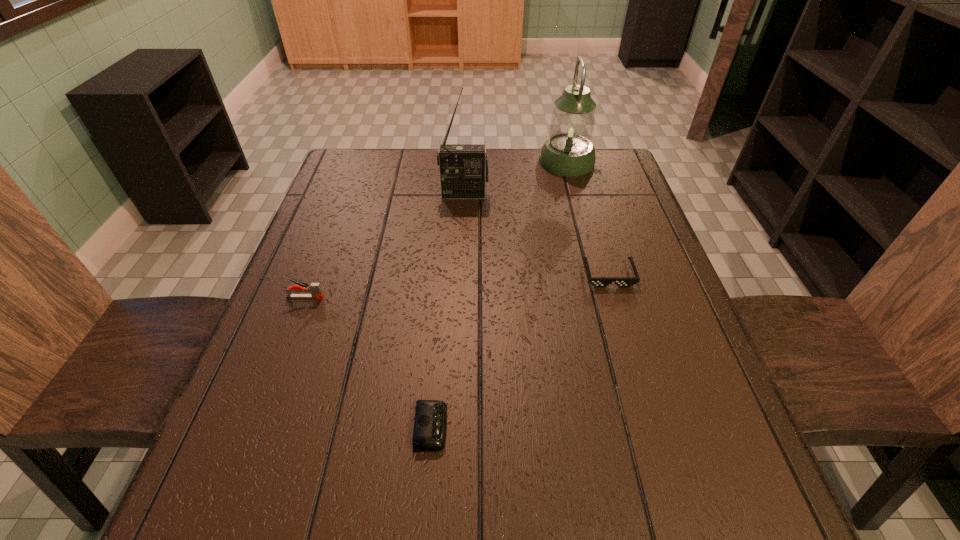
Image resolution: width=960 pixels, height=540 pixels. In order to click on vacant space at the right edge of the desktop in this screenshot , I will do `click(612, 304)`.

In order to click on free space at the far left corner of the desktop in this screenshot , I will do `click(367, 161)`.

What are the coordinates of `vacant space at the near left corner of the desktop` in the screenshot? It's located at (189, 538).

The width and height of the screenshot is (960, 540). What are the coordinates of `vacant space at the far right corner of the desktop` in the screenshot? It's located at (625, 178).

Image resolution: width=960 pixels, height=540 pixels. Identify the location of vacant area that lies between the fourth nearest object and the lantern. (516, 178).

Find the location of a particular element. Image resolution: width=960 pixels, height=540 pixels. free space that is in between the third tallest object and the nearest object is located at coordinates (369, 362).

You are a GUI agent. You are given a task and a screenshot of the screen. Output one action in this format:
    pyautogui.click(x=<x>, y=<y>)
    Task: Click on the free space between the nearest object and the fourth nearest object
    The image size is (960, 540).
    Given the screenshot: What is the action you would take?
    coord(447,311)

You are a GUI agent. You are given a task and a screenshot of the screen. Output one action in this format:
    pyautogui.click(x=<x>, y=<y>)
    Task: Click on the blank region between the radio receiver and the sunglasses
    
    Given the screenshot: What is the action you would take?
    pyautogui.click(x=537, y=235)

At what (x,y) coordinates should I click in order to perform the action: click on free spot between the sunglasses and the nearest object. Please return your answer as a coordinate pair (x, y). Image resolution: width=960 pixels, height=540 pixels. Looking at the image, I should click on (520, 351).

The height and width of the screenshot is (540, 960). Identify the location of unoccupied position between the third tallest object and the nearest object. (369, 362).